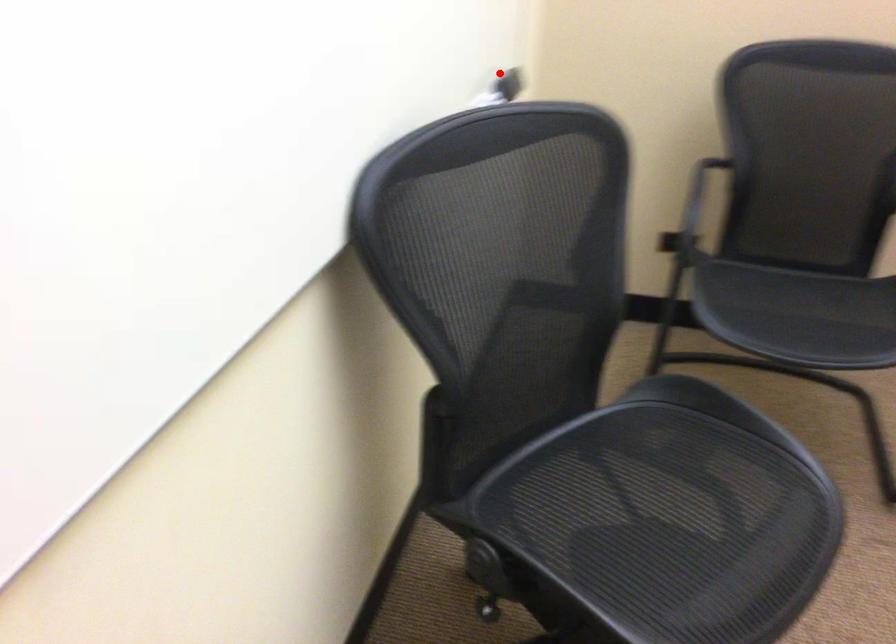
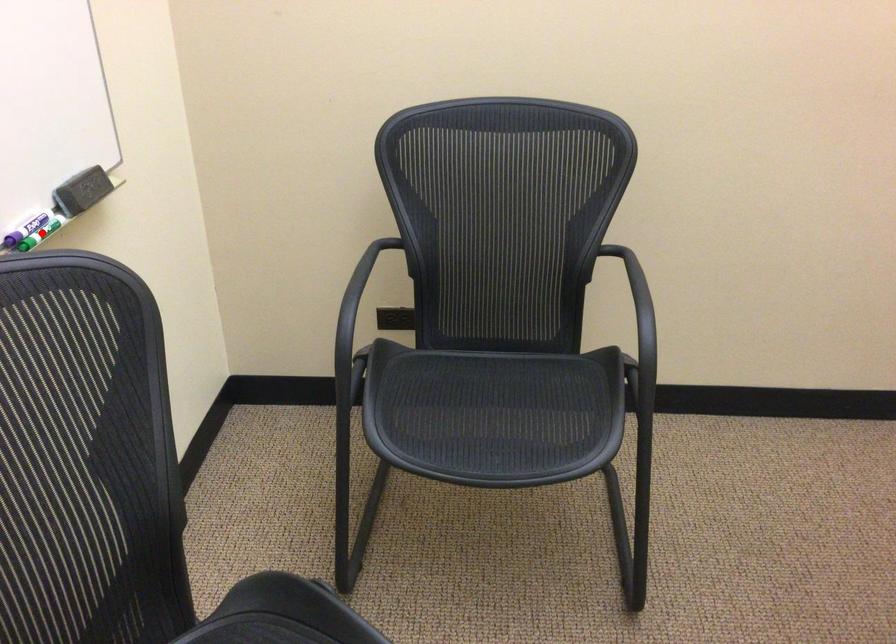
I am providing you with two images of the same scene from different viewpoints. A red point is marked on the first image and another point is marked on the second image. Is the marked point in image1 the same physical position as the marked point in image2?

No